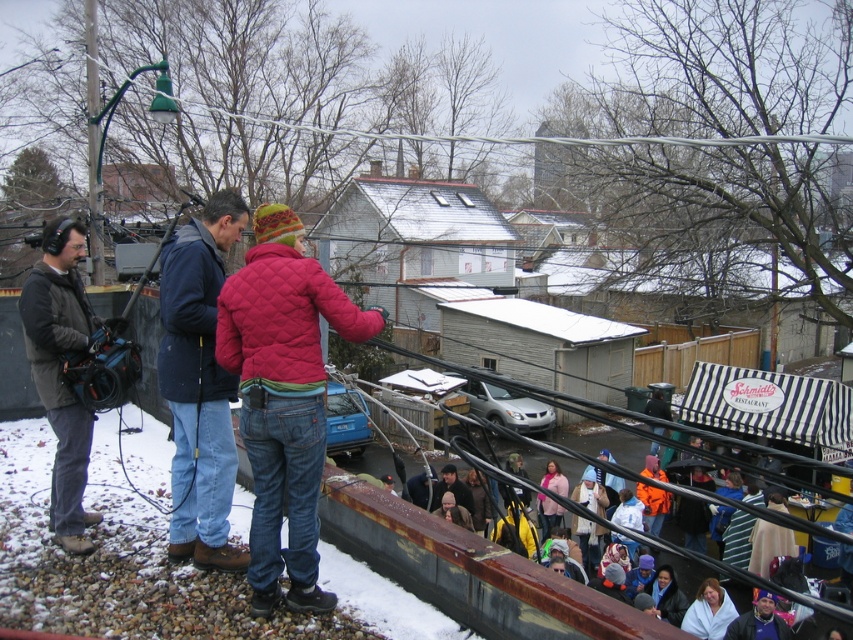
From the picture: You are a delivery person who needs to place a package between the white fleece blanket at lower right and the matte pink jacket at center. The package requires a minimum of 3 meters of space. Can you fit it there?

The distance between the white fleece blanket at lower right and the matte pink jacket at center is 3.87 meters, which is more than the required 3 meters. Therefore, the package can be placed there with sufficient space.

You are organizing a winter photoshoot and need to decide whether the white fleece blanket at lower right can fully cover the pink matte jacket at lower center. Based on their sizes, can the blanket cover the jacket completely?

The white fleece blanket at lower right is larger in width than the pink matte jacket at lower center, so yes, the blanket can fully cover the jacket.